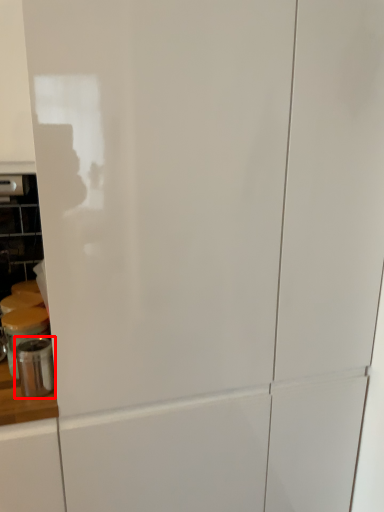
Question: Where is appliance (annotated by the red box) located in relation to appliance in the image?

Choices:
 (A) left
 (B) right

Answer: (B)